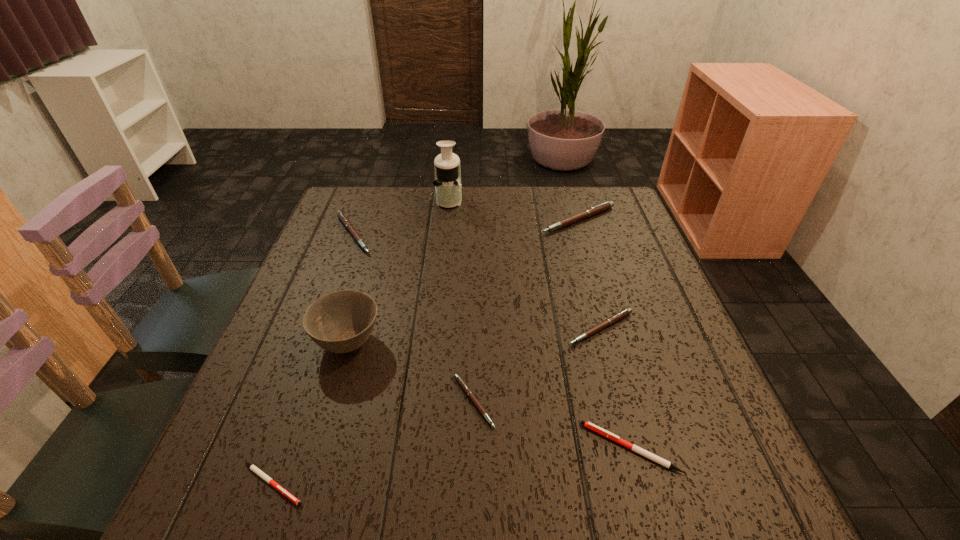
This screenshot has width=960, height=540. I want to click on the tallest object, so click(447, 182).

The width and height of the screenshot is (960, 540). I want to click on the fifth object from right to left, so click(x=447, y=182).

This screenshot has width=960, height=540. Find the location of `the seventh shortest object`. the seventh shortest object is located at coordinates (342, 321).

Locate an element on the screen. the biggest pink pen is located at coordinates (602, 207).

Where is `the tallest pen`? This screenshot has width=960, height=540. the tallest pen is located at coordinates (602, 207).

Identify the location of the fifth shortest object. (342, 217).

Image resolution: width=960 pixels, height=540 pixels. Find the location of `the leftmost pink pen`. the leftmost pink pen is located at coordinates (342, 217).

You are a GUI agent. You are given a task and a screenshot of the screen. Output one action in this format:
    pyautogui.click(x=<x>, y=<y>)
    Task: Click on the second smallest pink pen
    
    Given the screenshot: What is the action you would take?
    pyautogui.click(x=613, y=319)

Image resolution: width=960 pixels, height=540 pixels. I want to click on the fifth tallest object, so click(613, 319).

Locate an element on the screen. This screenshot has height=540, width=960. the nearest pink pen is located at coordinates (463, 385).